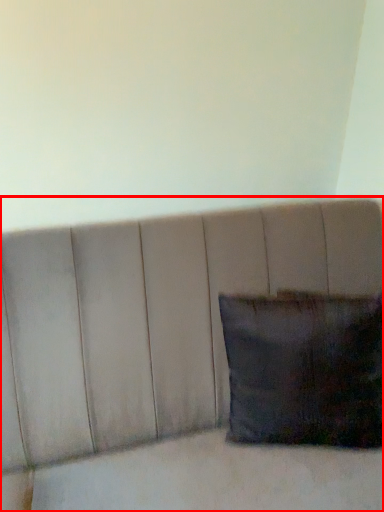
Question: From the image, what is the correct spatial relationship of furniture (annotated by the red box) in relation to pillow?

Choices:
 (A) left
 (B) right

Answer: (A)